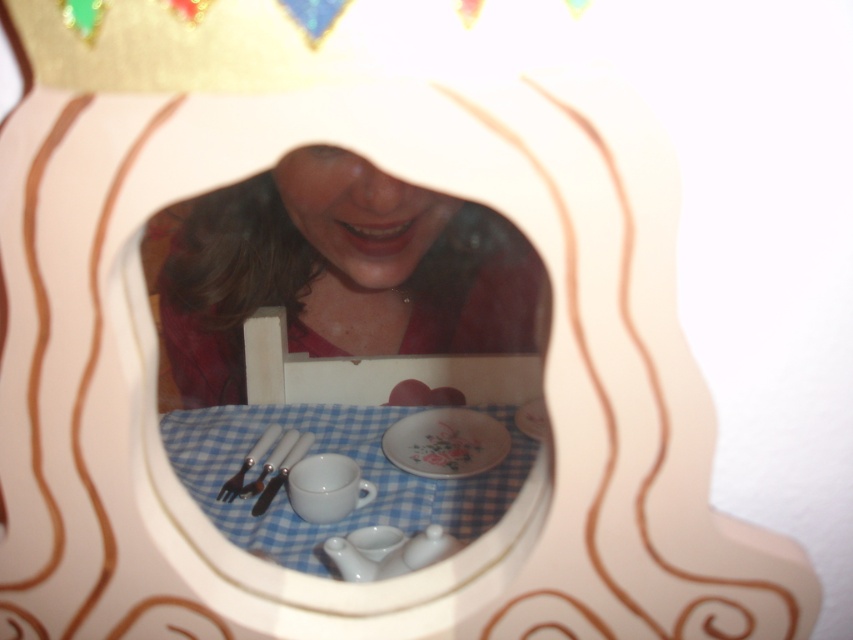
You are a small toy that is 7 inches wide. You want to place yourself between the white glossy mirror at center and the blue checkered tablecloth at center on the miniature table. Will you fit exactly between them without overlapping either?

The white glossy mirror at center is 7.10 inches from the blue checkered tablecloth at center. Since the toy is 7 inches wide, it will fit exactly between them with a small gap of 0.10 inches remaining.

You are a small toy mouse that can move freely around the miniature table set. You want to reach the floral porcelain plate at center to get some cheese. However, you are currently at the position of the satin silver fork at lower center. Which direction should you move to reach the plate?

The floral porcelain plate at center is positioned on the right side of the satin silver fork at lower center, so the mouse should move to the right to reach the plate.